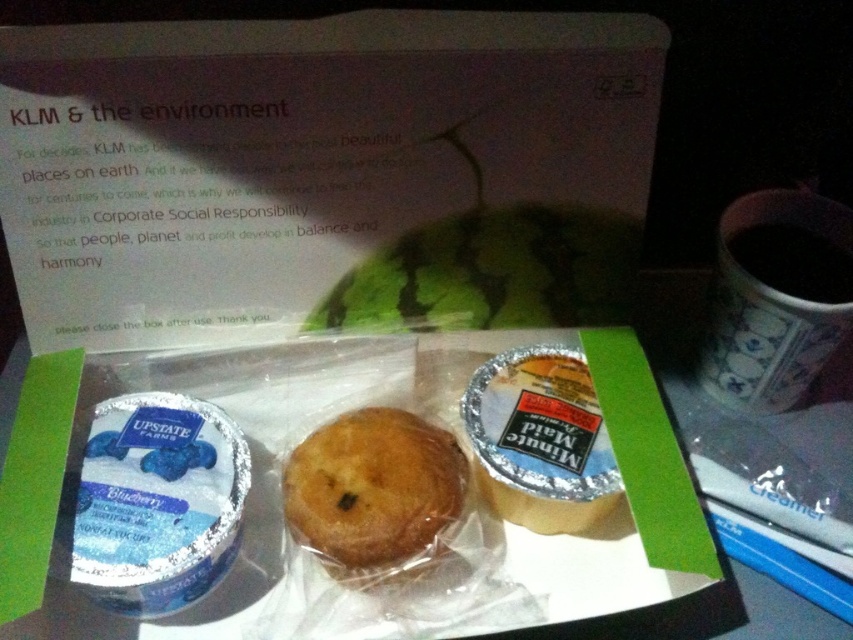
Question: Is golden brown muffin at center closer to the viewer compared to black matte cup at right?

Choices:
 (A) no
 (B) yes

Answer: (B)

Question: Does golden brown muffin at center appear on the left side of black matte cup at right?

Choices:
 (A) no
 (B) yes

Answer: (B)

Question: In this image, where is golden brown muffin at center located relative to black matte cup at right?

Choices:
 (A) below
 (B) above

Answer: (A)

Question: Which point appears closest to the camera in this image?

Choices:
 (A) (374, 493)
 (B) (796, 275)

Answer: (A)

Question: Which point is closer to the camera taking this photo?

Choices:
 (A) (306, 531)
 (B) (718, 380)
 (C) (804, 237)

Answer: (A)

Question: Which of the following is the farthest from the observer?

Choices:
 (A) (444, 436)
 (B) (773, 285)
 (C) (772, 268)

Answer: (C)